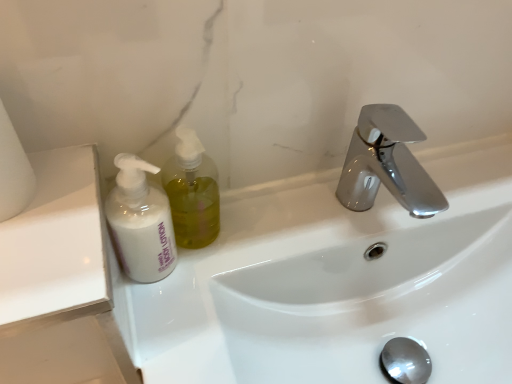
Find the location of a particular element. free space above white glossy sink at center (from a real-world perspective) is located at coordinates (329, 217).